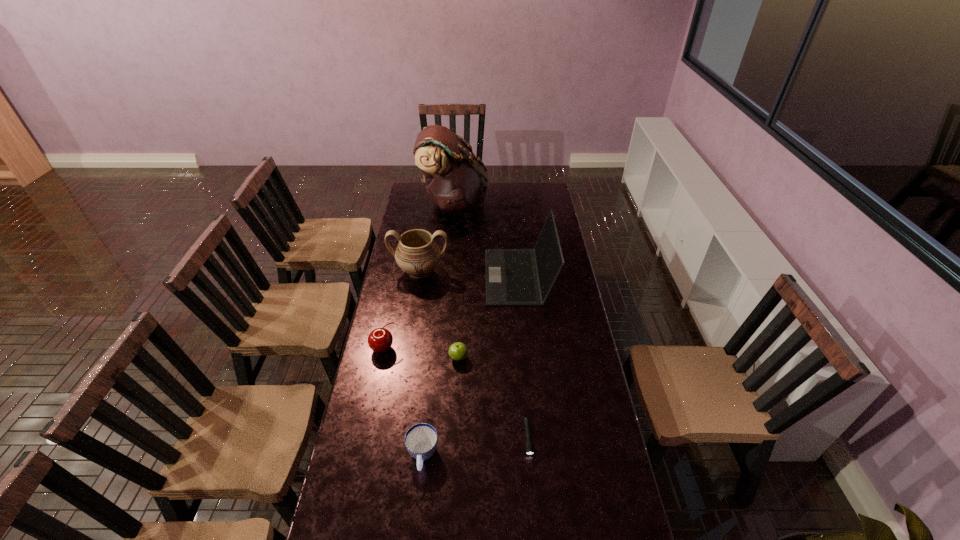
Where is `the tallest object`? The image size is (960, 540). the tallest object is located at coordinates (456, 180).

Locate an element on the screen. the farthest object is located at coordinates (456, 180).

Where is `laptop`? laptop is located at coordinates (513, 276).

Locate an element on the screen. The width and height of the screenshot is (960, 540). urn is located at coordinates (417, 254).

Image resolution: width=960 pixels, height=540 pixels. Identify the location of cherry. (380, 340).

The width and height of the screenshot is (960, 540). Find the location of `apple`. apple is located at coordinates (458, 351).

I want to click on cup, so click(x=421, y=439).

Find the location of a particular element. flashlight is located at coordinates 529,446.

Identify the location of vacant region located at the front of the tallest object with buckles. [532, 203].

The image size is (960, 540). Find the location of `free spot located 0.180m on the screen of the laptop`. free spot located 0.180m on the screen of the laptop is located at coordinates (447, 276).